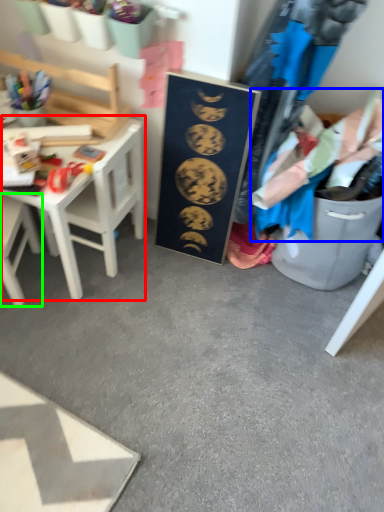
Question: Which object is positioned closest to table (highlighted by a red box)? Select from clothing (highlighted by a blue box) and chair (highlighted by a green box).

Choices:
 (A) clothing
 (B) chair

Answer: (B)